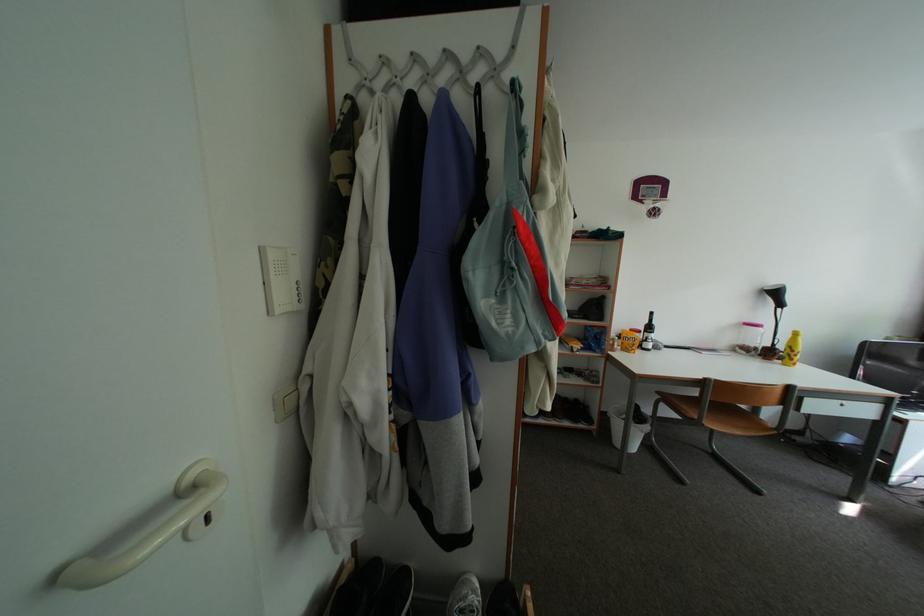
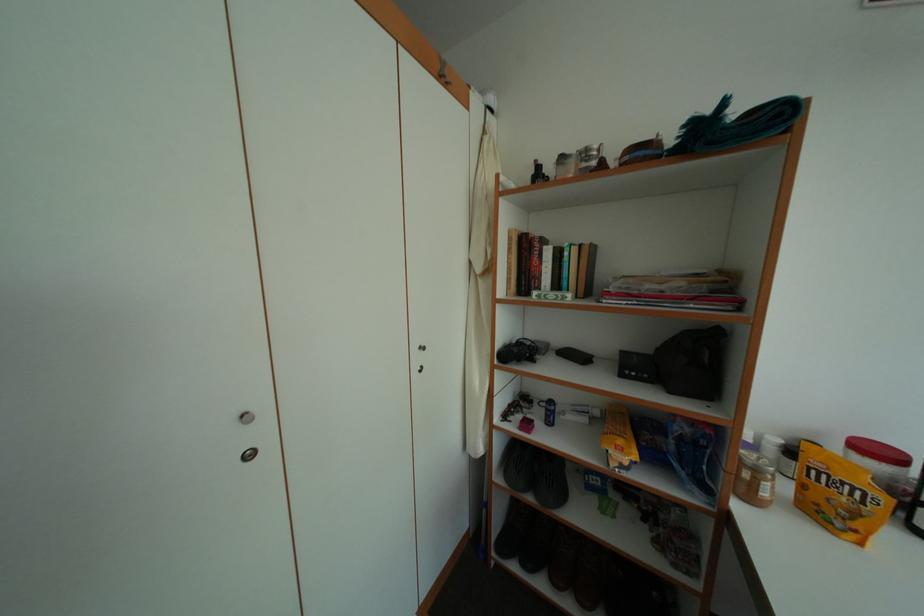
What movement of the cameraman would produce the second image?

The cameraman walked toward right, forward.